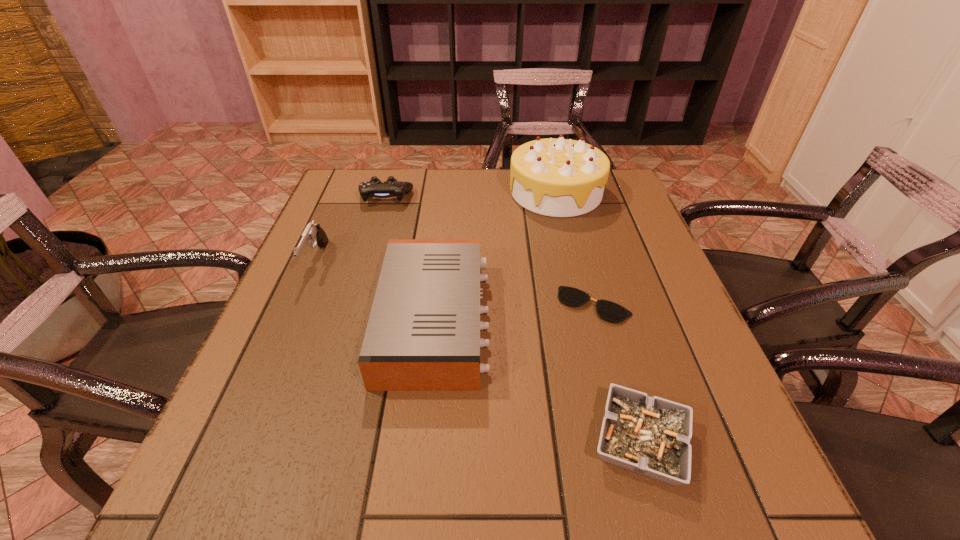
Where is `free space that satisfies the following two spatial constraints: 1. on the front side of the birthday cake; 2. on the control panel of the radio receiver`? This screenshot has width=960, height=540. free space that satisfies the following two spatial constraints: 1. on the front side of the birthday cake; 2. on the control panel of the radio receiver is located at coordinates (588, 321).

This screenshot has height=540, width=960. Find the location of `vacant area that satisfies the following two spatial constraints: 1. on the back side of the second shortest object; 2. on the control panel of the radio receiver`. vacant area that satisfies the following two spatial constraints: 1. on the back side of the second shortest object; 2. on the control panel of the radio receiver is located at coordinates (607, 321).